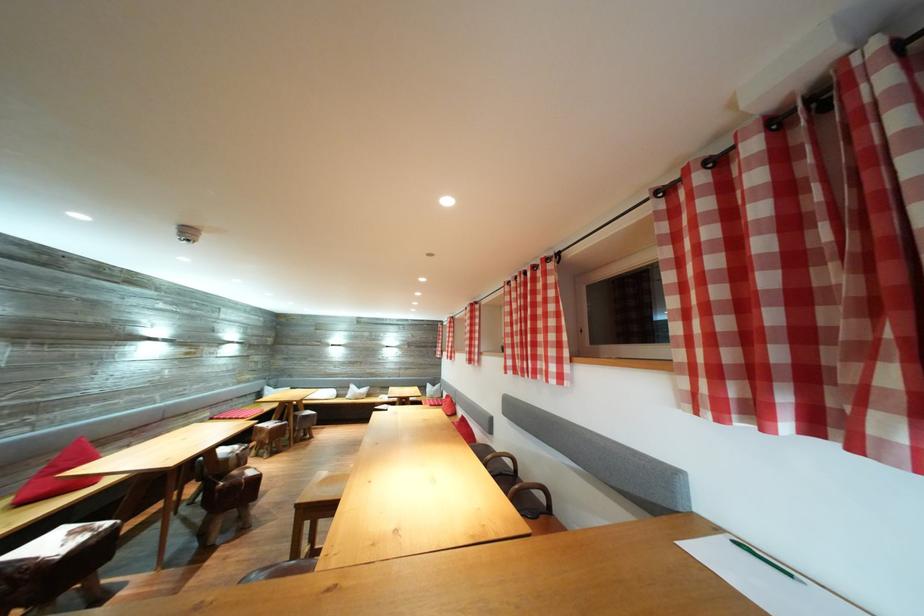
Where would you sit the sofa sitting surface? Please return your answer as a coordinate pair (x, y).

(345, 395)